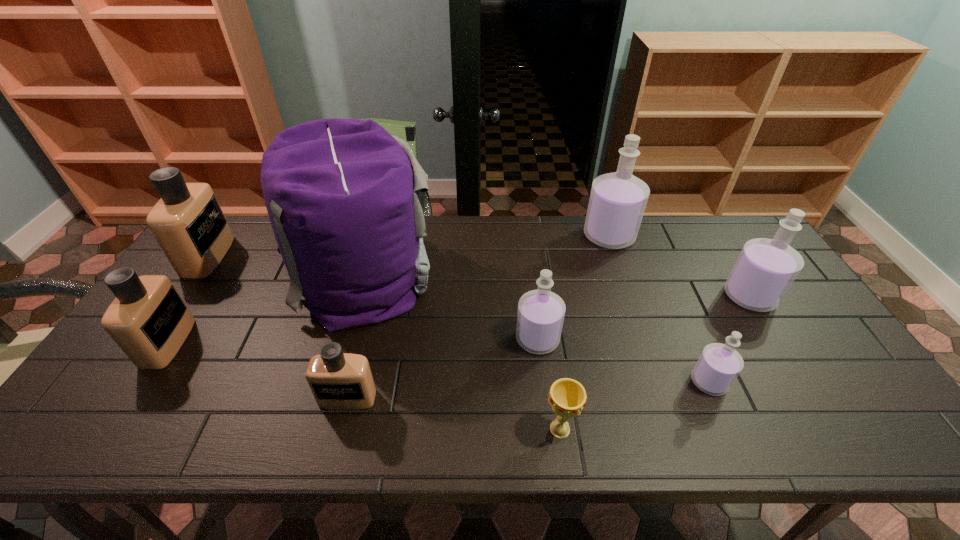
You are a GUI agent. You are given a task and a screenshot of the screen. Output one action in this format:
    pyautogui.click(x=<x>, y=<y>)
    Task: Click on the nearest purple perfume
    
    Given the screenshot: What is the action you would take?
    pyautogui.click(x=718, y=366)

In order to click on the fifth perfume from right to left in this screenshot , I will do `click(339, 381)`.

This screenshot has width=960, height=540. What are the coordinates of `the rightmost beige perfume` in the screenshot? It's located at (339, 381).

Locate an element on the screen. chalice is located at coordinates (567, 397).

At what (x,y) coordinates should I click in order to perform the action: click on the nearest object. Please return your answer as a coordinate pair (x, y). The image size is (960, 540). Looking at the image, I should click on (567, 397).

The width and height of the screenshot is (960, 540). In order to click on vacant area situated 0.280m on the front pocket of the tallest object in this screenshot , I will do `click(530, 274)`.

Identify the location of vacant space located on the left of the biggest purple perfume. pos(527,236).

Find the location of a particular element. vacant region located 0.070m on the front label of the farthest beige perfume is located at coordinates (247, 256).

Locate an element on the screen. free region located on the left of the third farthest perfume is located at coordinates (656, 297).

This screenshot has width=960, height=540. I want to click on blank space located 0.140m on the back of the leftmost purple perfume, so click(531, 287).